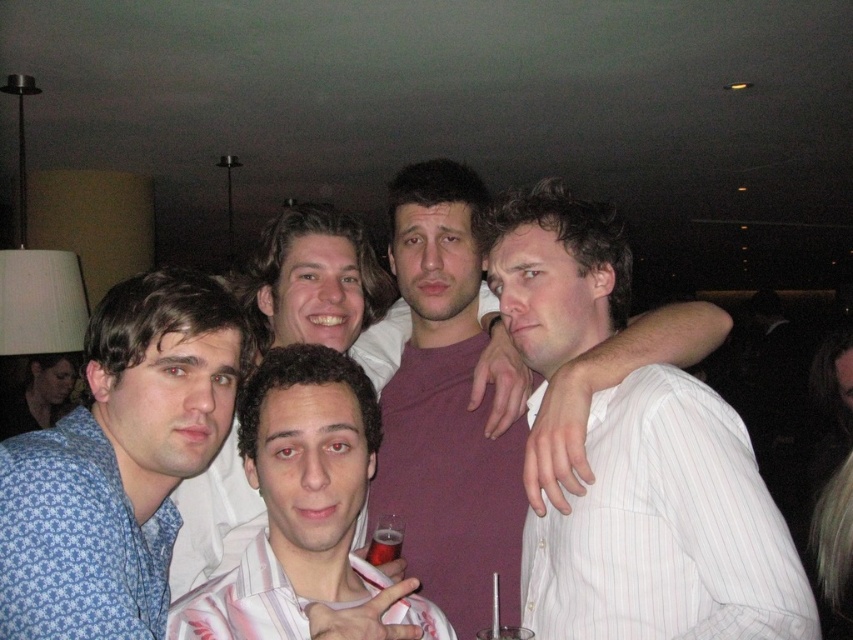
Based on the photo, you are at a party and want to hand a drink to the person wearing the blue floral fabric shirt at left and the white striped shirt at center. Since you can only reach the nearest person, which one can you give the drink to first?

The blue floral fabric shirt at left is closer to the viewer than the white striped shirt at center, so you can give the drink to the blue floral fabric shirt at left first.

You are a photographer trying to capture a clear photo of the blue patterned shirt at left and the white striped shirt at center. Since the background is dark and out of focus, which shirt should you focus on to ensure it appears sharp in the photo?

The blue patterned shirt at left is closer to the viewer than the white striped shirt at center, so focusing on the blue patterned shirt at left will ensure it appears sharp while the background remains blurred.

You are at a party and want to get the drink from the person wearing the white striped shirt at center. Since the blue floral fabric shirt at left is blocking your view, can you still reach the drink?

The blue floral fabric shirt at left is positioned over white striped shirt at center, so the person in the blue floral fabric shirt at left is blocking the drink, making it difficult to reach.